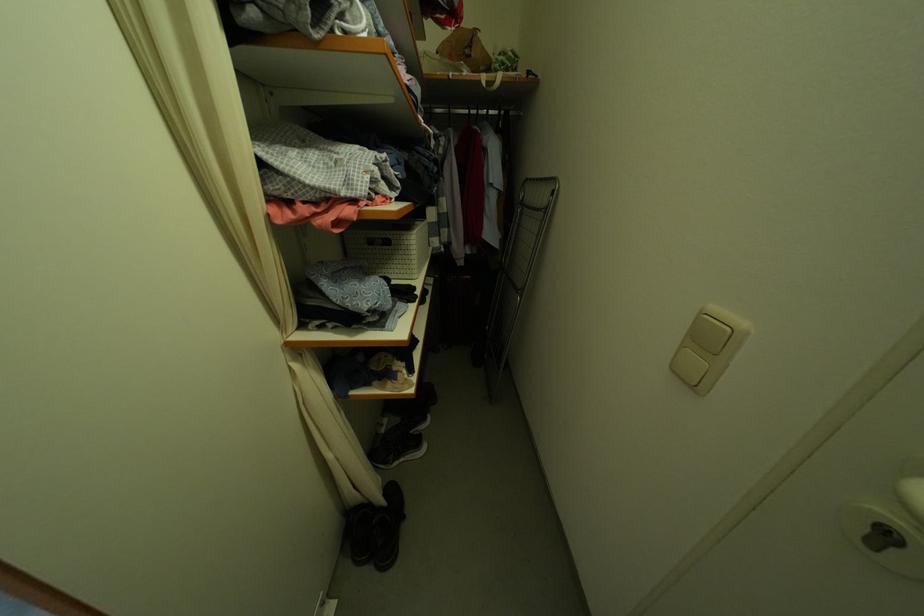
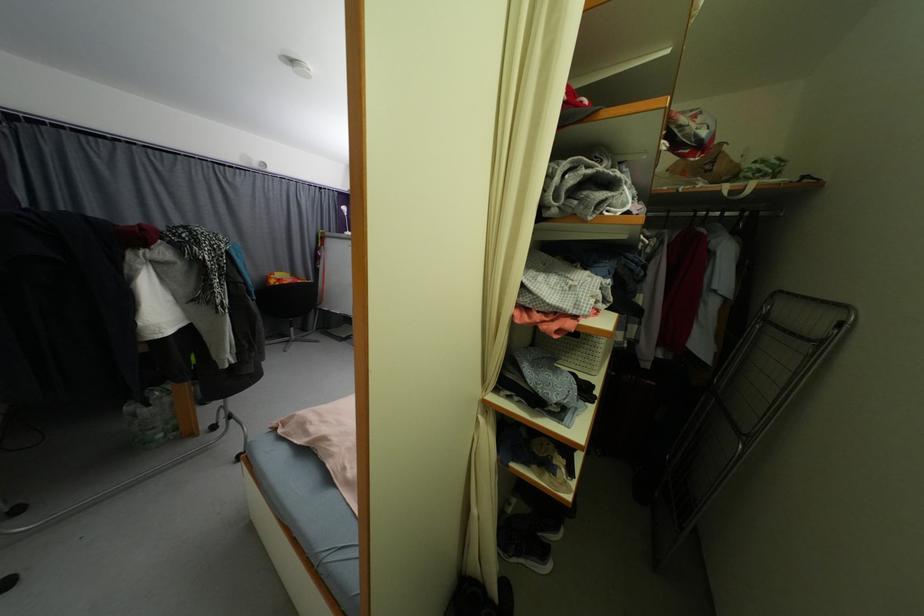
Where in the second image is the point corresponding to (403,460) from the first image?

(524, 557)